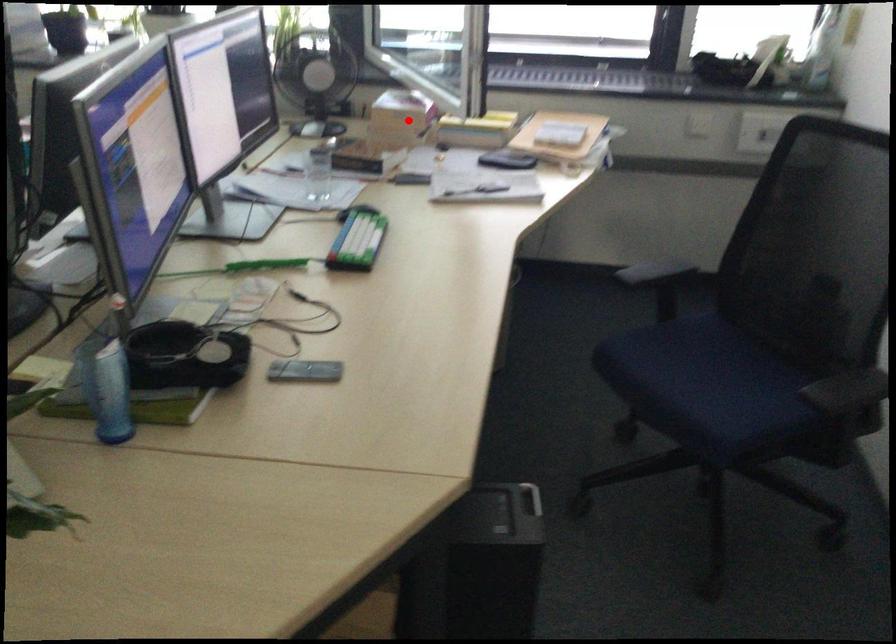
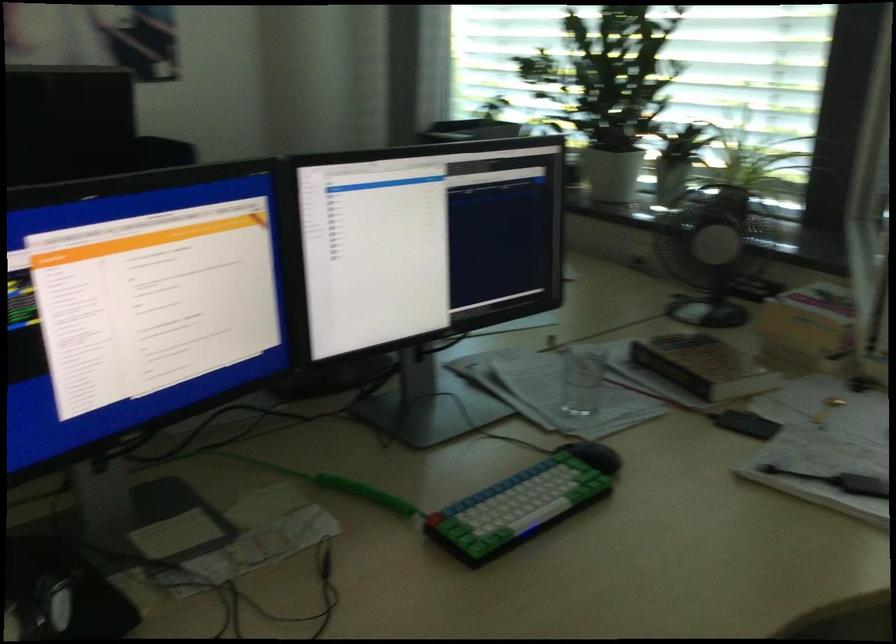
Question: I am providing you with two images of the same scene from different viewpoints. In image1, a red point is highlighted. Considering the same 3D point in image2, which of the following is correct?

Choices:
 (A) It is closer
 (B) It is farther

Answer: (A)